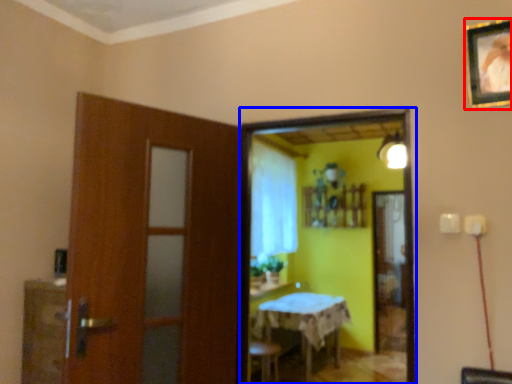
Question: Among these objects, which one is nearest to the camera, picture frame (highlighted by a red box) or mirror (highlighted by a blue box)?

Choices:
 (A) picture frame
 (B) mirror

Answer: (A)